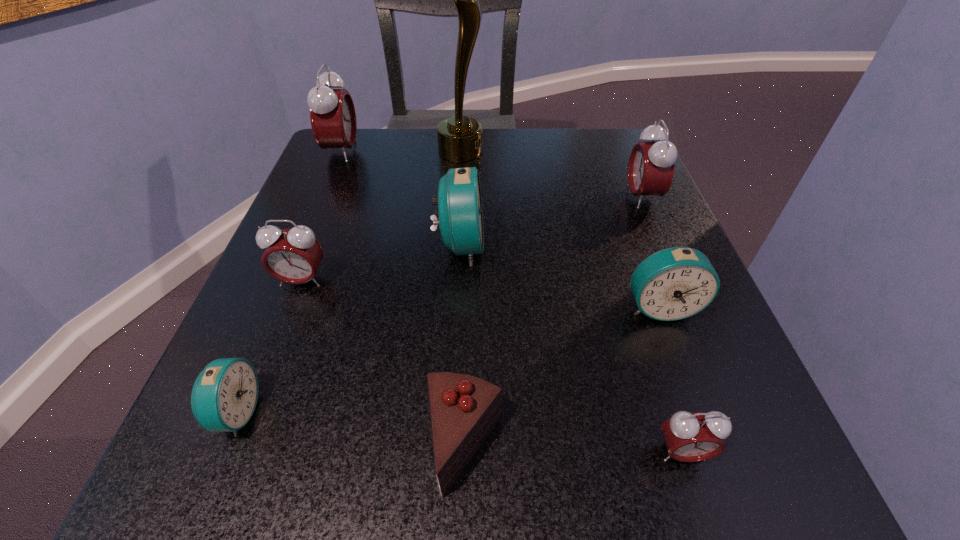
Locate an element on the screen. the third closest alarm clock to the farthest pink alarm clock is located at coordinates (224, 396).

Select which pink alarm clock is the fourth closest to the second blue alarm clock from left to right. Please provide its 2D coordinates. Your answer should be formatted as a tuple, i.e. [(x, y)], where the tuple contains the x and y coordinates of a point satisfying the conditions above.

[(689, 437)]

The image size is (960, 540). I want to click on pink alarm clock that can be found as the fourth closest to the tallest object, so click(x=689, y=437).

Where is `blue alarm clock that stands as the second closest to the farthest blue alarm clock`? The width and height of the screenshot is (960, 540). blue alarm clock that stands as the second closest to the farthest blue alarm clock is located at coordinates (224, 396).

The image size is (960, 540). In order to click on blue alarm clock object that ranks as the third closest to the smallest pink alarm clock in this screenshot , I will do `click(224, 396)`.

Locate an element on the screen. The height and width of the screenshot is (540, 960). free space that satisfies the following two spatial constraints: 1. on the front-facing side of the second biggest blue alarm clock; 2. on the front-facing side of the nearest blue alarm clock is located at coordinates (699, 412).